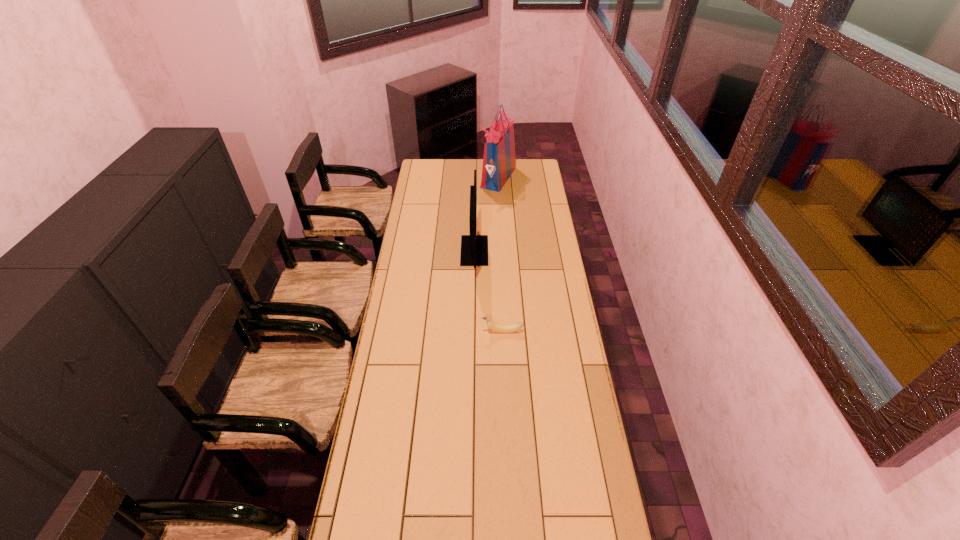
This screenshot has width=960, height=540. In order to click on the farthest object in this screenshot , I will do `click(499, 162)`.

Locate an element on the screen. grocery bag is located at coordinates (499, 162).

The width and height of the screenshot is (960, 540). I want to click on the second tallest object, so click(474, 248).

Locate an element on the screen. Image resolution: width=960 pixels, height=540 pixels. the second nearest object is located at coordinates [474, 248].

Where is `the nearest object`? The image size is (960, 540). the nearest object is located at coordinates (491, 325).

This screenshot has height=540, width=960. I want to click on the shortest object, so click(491, 325).

This screenshot has height=540, width=960. I want to click on vacant region located on the front-facing side of the farthest object, so click(x=453, y=178).

You are a GUI agent. You are given a task and a screenshot of the screen. Output one action in this format:
    pyautogui.click(x=<x>, y=<y>)
    Task: Click on the blank area located 0.300m on the front-facing side of the farthest object
    This screenshot has width=960, height=540.
    Given the screenshot: What is the action you would take?
    pyautogui.click(x=430, y=178)

This screenshot has width=960, height=540. Find the location of `vacant space located on the front-facing side of the farthest object`. vacant space located on the front-facing side of the farthest object is located at coordinates (433, 178).

I want to click on free space located 0.290m on the screen side of the second tallest object, so click(546, 251).